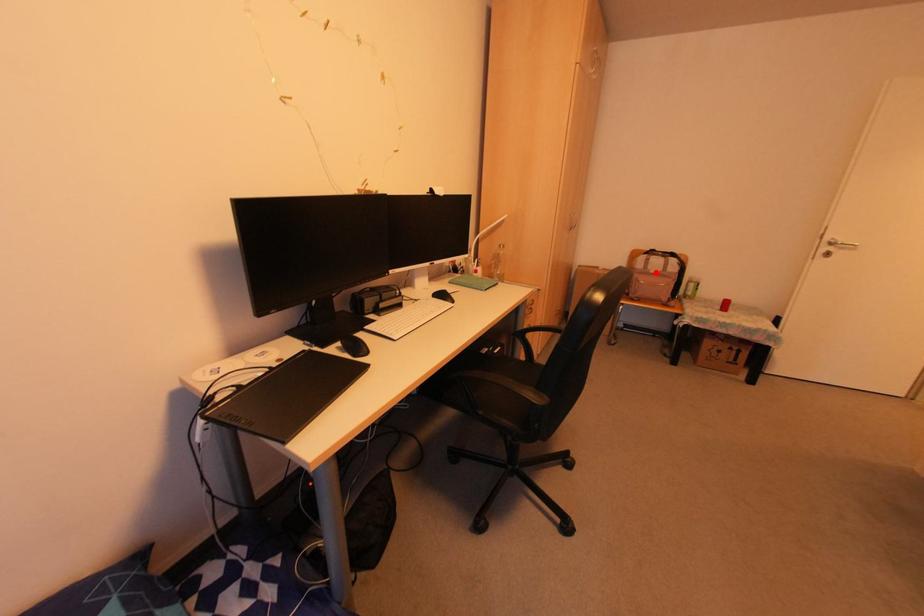
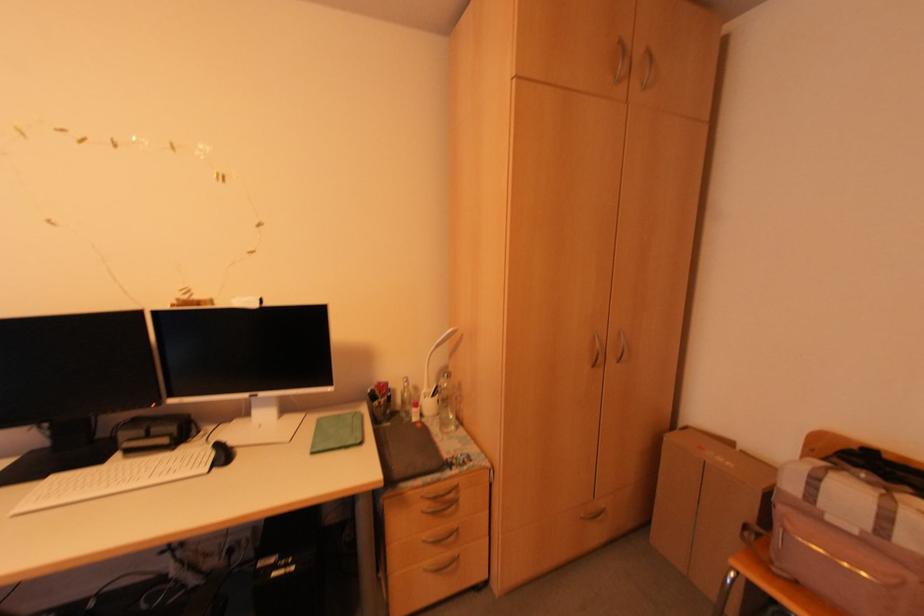
Question: I am providing you with two images of the same scene from different viewpoints. A red point is shown in image1. For the corresponding object point in image2, is it positioned nearer or farther from the camera?

Choices:
 (A) Nearer
 (B) Farther

Answer: (A)